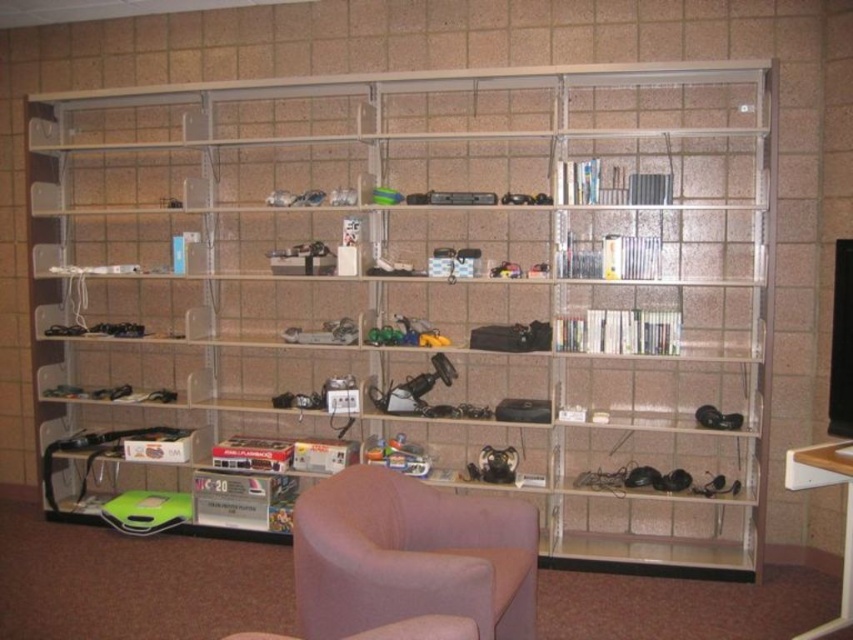
Question: Among these objects, which one is farthest from the camera?

Choices:
 (A) pink fabric swivel chair at lower center
 (B) clear plastic bookcase at center

Answer: (B)

Question: Which point is farther from the camera taking this photo?

Choices:
 (A) (389, 582)
 (B) (314, 333)

Answer: (B)

Question: Is clear plastic bookcase at center to the right of pink fabric swivel chair at lower center from the viewer's perspective?

Choices:
 (A) no
 (B) yes

Answer: (A)

Question: Is the position of clear plastic bookcase at center less distant than that of pink fabric swivel chair at lower center?

Choices:
 (A) no
 (B) yes

Answer: (A)

Question: Does clear plastic bookcase at center have a smaller size compared to pink fabric swivel chair at lower center?

Choices:
 (A) yes
 (B) no

Answer: (B)